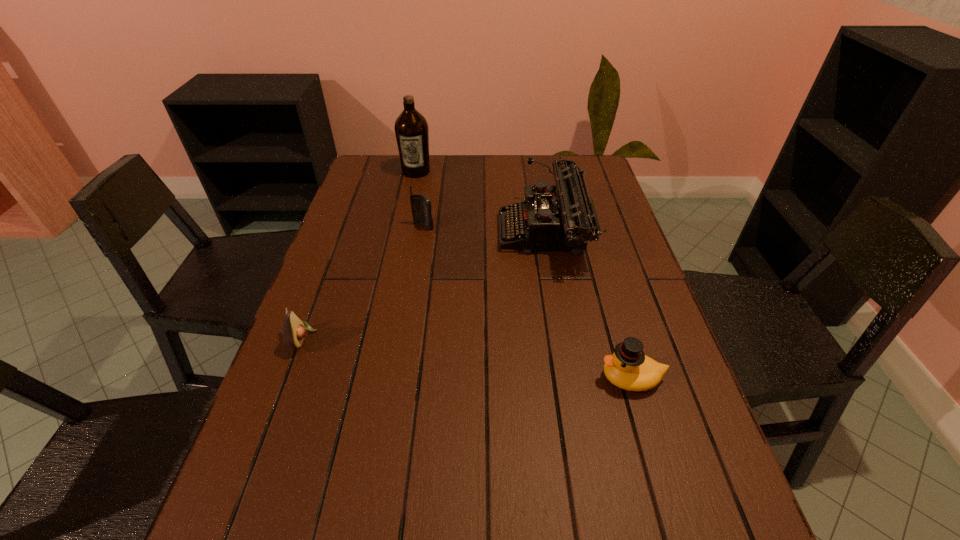
Locate an element on the screen. This screenshot has height=540, width=960. olive oil is located at coordinates (411, 128).

The height and width of the screenshot is (540, 960). I want to click on the farthest object, so pyautogui.click(x=411, y=128).

Where is `typewriter`? The width and height of the screenshot is (960, 540). typewriter is located at coordinates (563, 217).

You are a GUI agent. You are given a task and a screenshot of the screen. Output one action in this format:
    pyautogui.click(x=<x>, y=<y>)
    Task: Click on the cellular telephone
    The width and height of the screenshot is (960, 540).
    Given the screenshot: What is the action you would take?
    pyautogui.click(x=421, y=205)

Locate an element on the screen. The width and height of the screenshot is (960, 540). the nearest object is located at coordinates (628, 368).

The height and width of the screenshot is (540, 960). Identify the location of the leftmost object. (x=294, y=330).

Image resolution: width=960 pixels, height=540 pixels. In order to click on avocado in this screenshot , I will do `click(294, 330)`.

Find the location of a particular element. vacant area situated on the label of the farthest object is located at coordinates (405, 225).

Locate an element on the screen. The width and height of the screenshot is (960, 540). free space located on the keyboard of the typewriter is located at coordinates (418, 234).

Find the location of a particular element. vacant region located 0.310m on the keyboard of the typewriter is located at coordinates (395, 234).